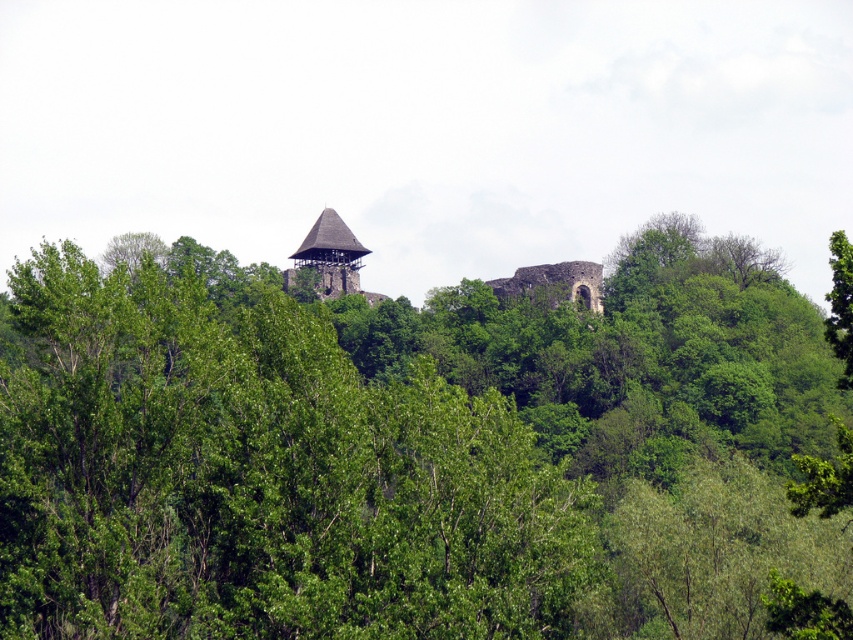
You are standing in the lush green landscape looking at the castle. There are two points marked on your map. The first point is at coordinates point [590,269] and the second at point [846,284]. Which point is closer to you?

Point [590,269] is closer to you because it is further to the viewer than point [846,284].

You are an artist sketching the landscape and want to ensure the proportions between the green leafy tree at upper center and the green leafy tree at upper right are accurate. Which tree should you draw taller?

The green leafy tree at upper center should be drawn taller since it has a greater height compared to the green leafy tree at upper right.

You are standing at the point with coordinates point (834, 316) and want to walk to the point with coordinates point (294, 262). Will you have to go around any obstacles along the way?

Point (294, 262) is behind point (834, 316), so you will have to go around any obstacles that may be blocking the path between them.